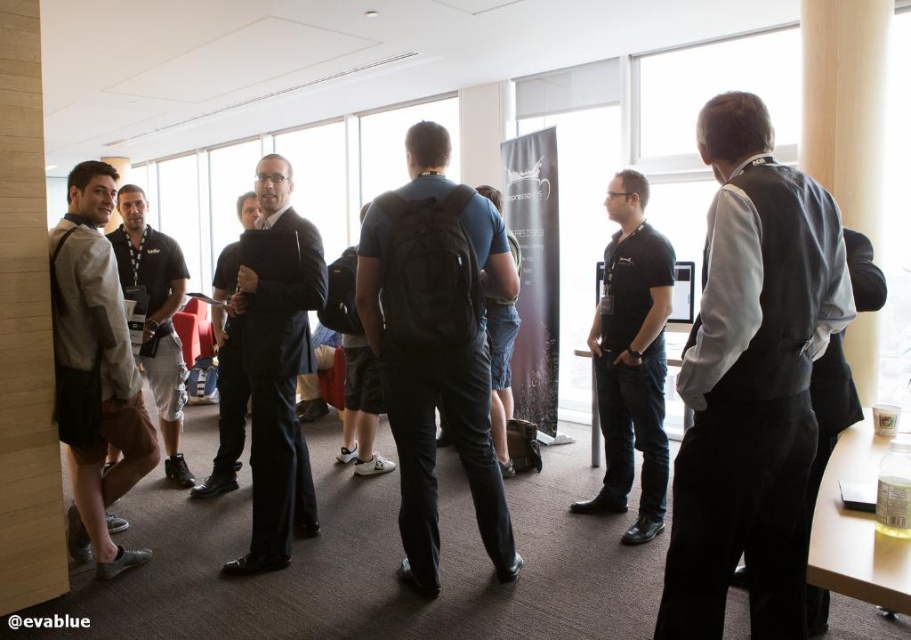
You are a photographer at a networking event and need to capture a clear photo of the dark gray vest at right without the black matte backpack at center blocking it. How should you adjust your position?

Move to the left side so that the dark gray vest at right is no longer positioned over the black matte backpack at center, allowing an unobstructed view of the dark gray vest at right.

In the scene described, where is the matte black suit at center located in terms of coordinates?

The matte black suit at center is located at coordinates point (277, 376).

Looking at this image, you are organizing a photo shoot and need to arrange two items in a specific order based on their positions in the image. The items are the dark gray vest at right and the black matte backpack at center. Which item should be placed first if you want to follow the leftmost to rightmost order?

The black matte backpack at center should be placed first because the dark gray vest at right is positioned on the right side of it, making the backpack the leftmost item.